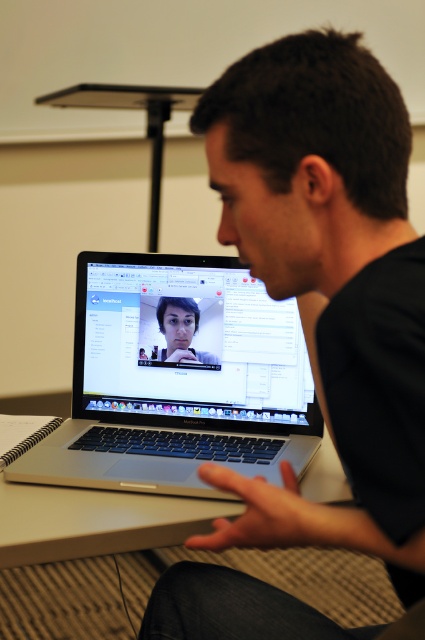
You are setting up a dual monitor setup for a video call. You have two laptops, the black matte laptop at center and the silver metallic laptop at center. Since you want the taller one to be the primary display, which laptop should you choose as the main screen?

The black matte laptop at center has a greater height compared to the silver metallic laptop at center, so you should choose the black matte laptop at center as the main screen for the dual monitor setup.

You are trying to decide whether to place a large coffee mug on the desk. The black matte laptop at center and the silver metallic table at center are already there. Based on their sizes, which object would you avoid placing the mug near to prevent it from being too crowded?

The black matte laptop at center is bigger than the silver metallic table at center, so placing the mug near the black matte laptop at center would be more crowded due to its larger size.

You are a delivery robot with a height of 24 inches. You need to deliver a package to the desk where the black matte laptop at center is located. Can you safely place the package on the desk without knocking over the laptop?

The black matte laptop at center is 21.41 inches away from the viewer. Since the robot is 24 inches tall, it can safely place the package on the desk as the laptop is within reach and the robot can maneuver around it without knocking it over.